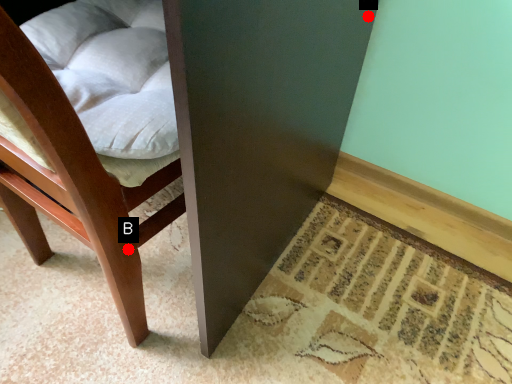
Question: Two points are circled on the image, labeled by A and B beside each circle. Among these points, which one is nearest to the camera?

Choices:
 (A) A is closer
 (B) B is closer

Answer: (B)